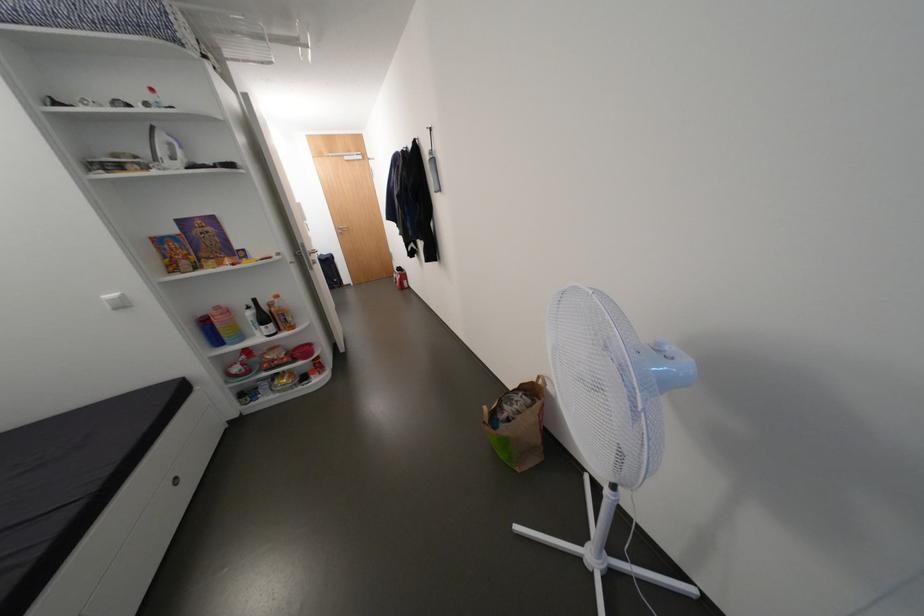
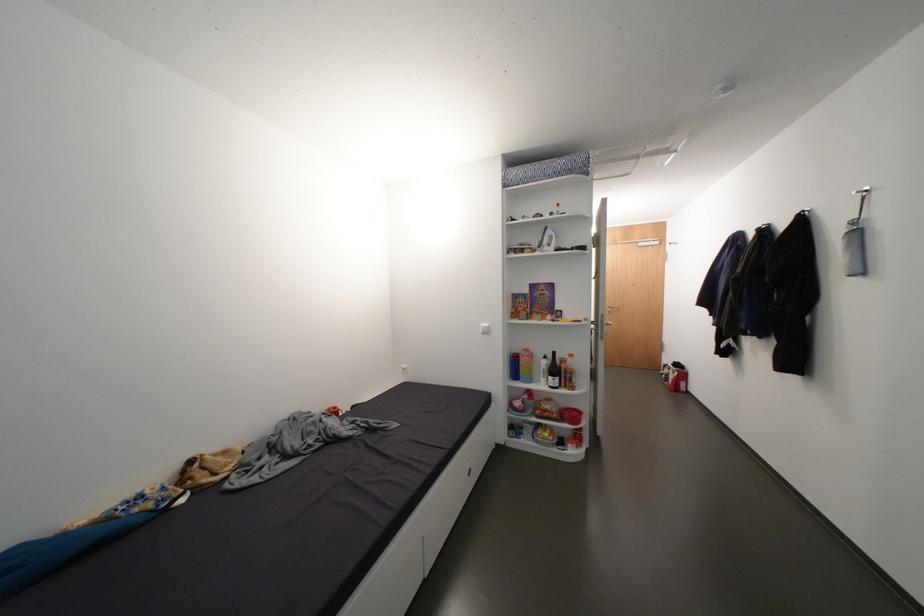
Where in the second image is the point corresponding to (x=407, y=277) from the first image?

(684, 374)